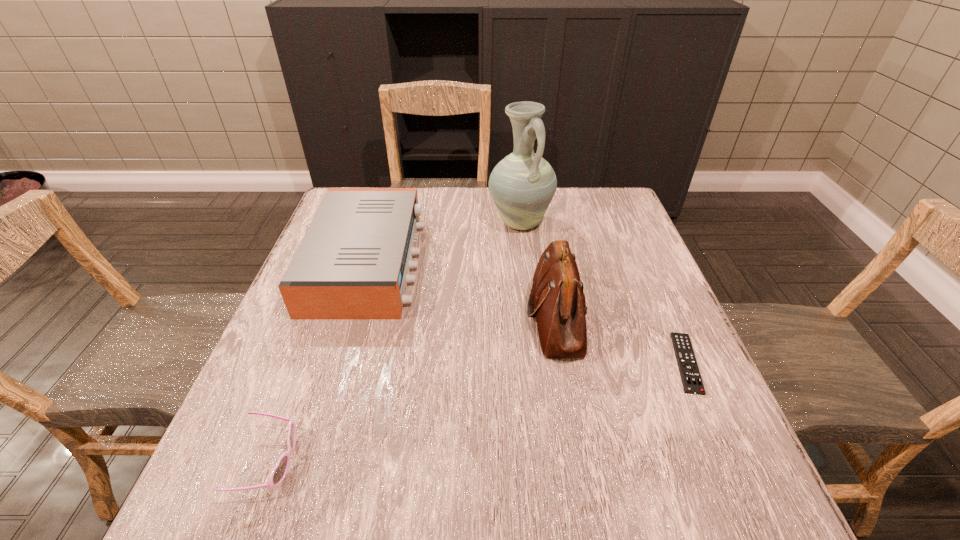
The width and height of the screenshot is (960, 540). What are the coordinates of `vacant space that satisfies the following two spatial constraints: 1. on the back side of the rightmost object; 2. on the control panel of the third tallest object` in the screenshot? It's located at (642, 262).

Where is `vacant position in the image that satisfies the following two spatial constraints: 1. on the control panel of the radio receiver; 2. on the left side of the shoulder bag`? vacant position in the image that satisfies the following two spatial constraints: 1. on the control panel of the radio receiver; 2. on the left side of the shoulder bag is located at coordinates (351, 317).

Find the location of a particular element. vacant space that satisfies the following two spatial constraints: 1. on the handle side of the pitcher; 2. on the right side of the shortest object is located at coordinates (537, 363).

The height and width of the screenshot is (540, 960). Find the location of `free region that satisfies the following two spatial constraints: 1. on the handle side of the pitcher; 2. on the front-facing side of the fourth tallest object`. free region that satisfies the following two spatial constraints: 1. on the handle side of the pitcher; 2. on the front-facing side of the fourth tallest object is located at coordinates (549, 462).